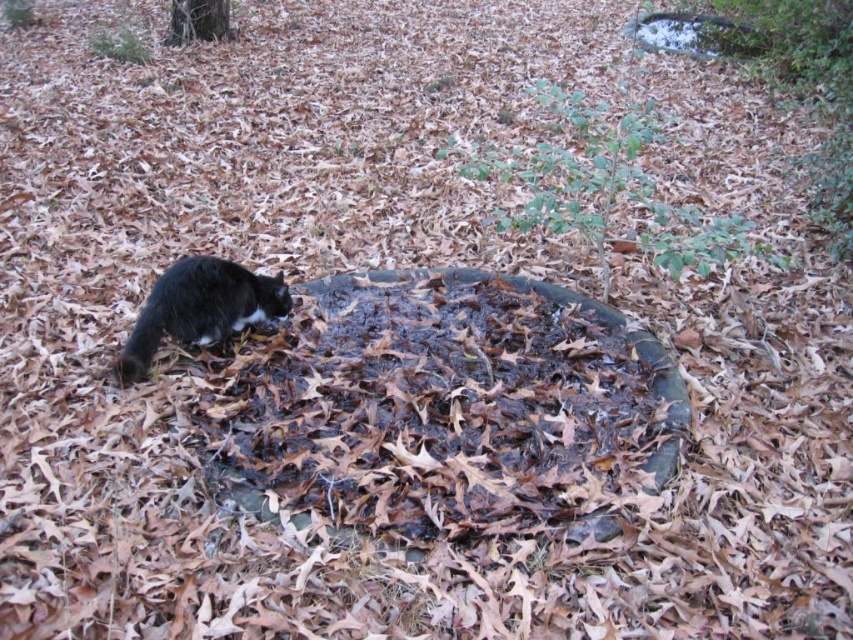
You are standing in an autumn scene with fallen leaves. You see a black fur cat at lower left and a smooth bark tree at upper left. Which object is closer to you?

The black fur cat at lower left is closer to you because it is in front of the smooth bark tree at upper left.

A black fur cat at lower left is located at what coordinates?

The black fur cat at lower left is located at coordinates point (199, 308).